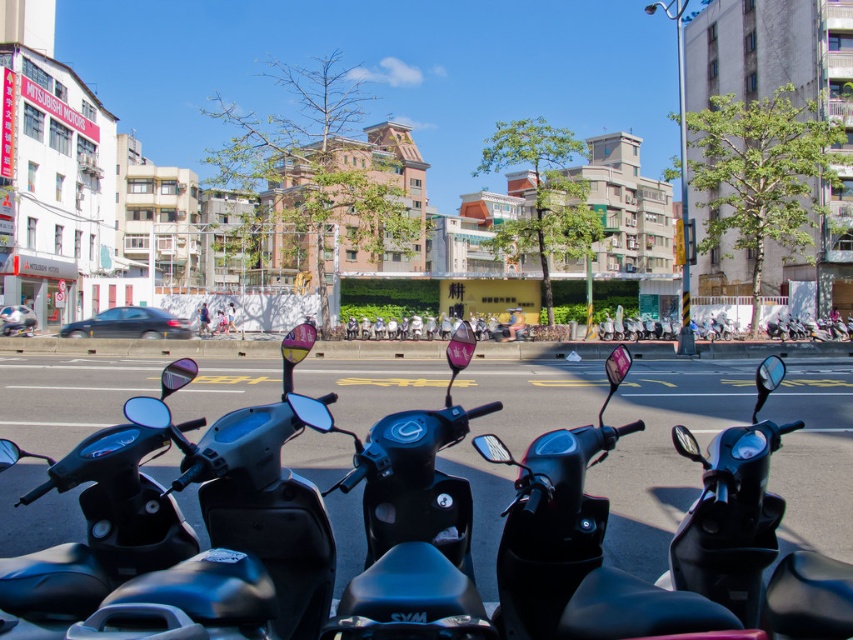
Question: Can you confirm if matte black motorbike at center is positioned to the left of black matte scooter at center?

Choices:
 (A) no
 (B) yes

Answer: (B)

Question: Is the position of matte black motorbike at center less distant than that of black matte scooter at center?

Choices:
 (A) yes
 (B) no

Answer: (B)

Question: Can you confirm if matte black motorbike at center is smaller than black matte scooter at center?

Choices:
 (A) yes
 (B) no

Answer: (A)

Question: Which point is closer to the camera taking this photo?

Choices:
 (A) (556, 541)
 (B) (750, 461)

Answer: (B)